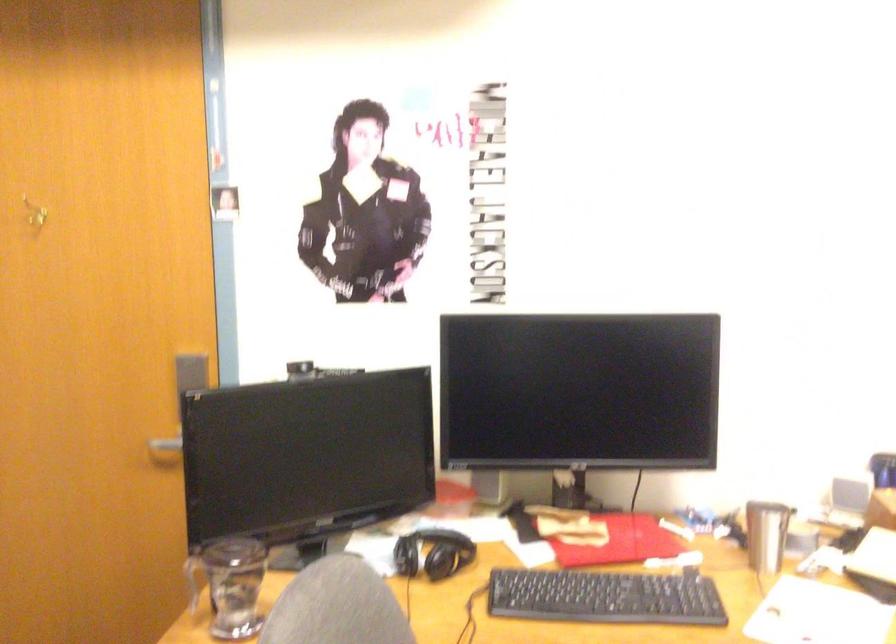
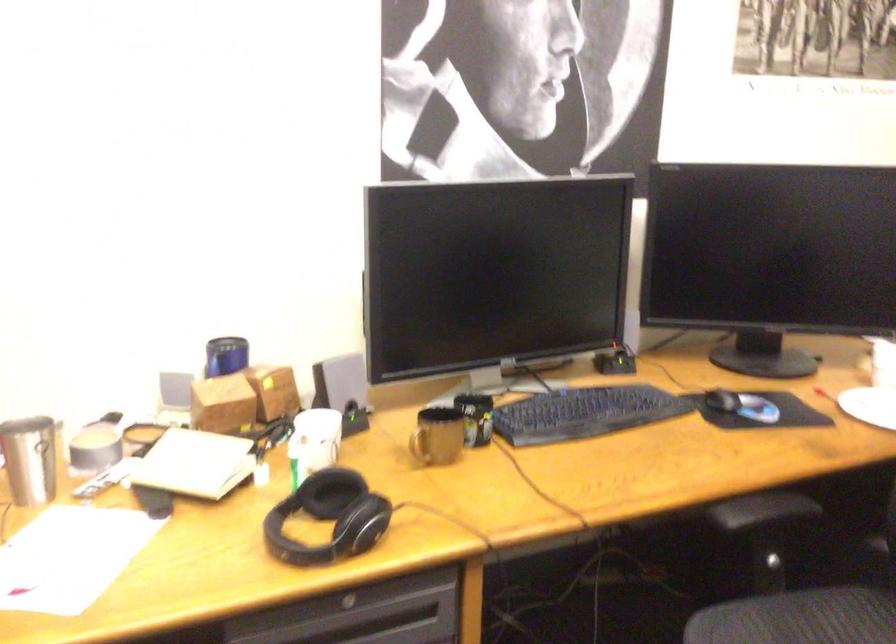
Find the pixel in the second image that matches point 771,526 in the first image.

(30, 459)